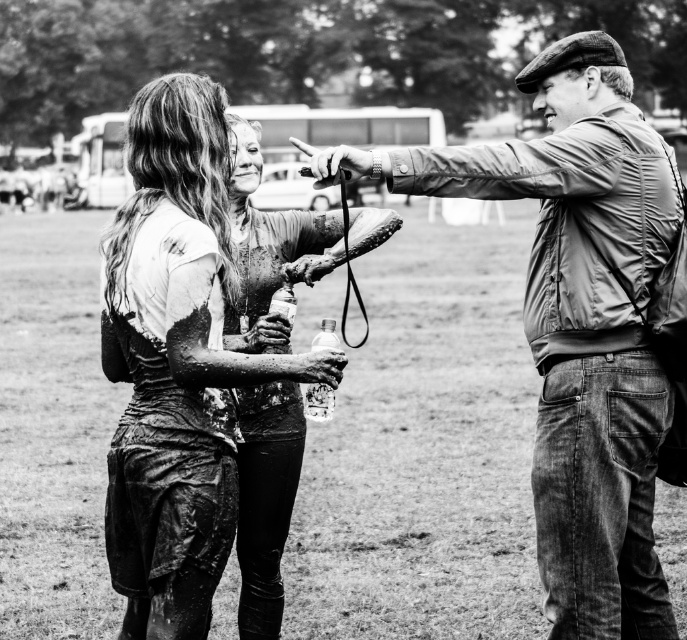
Can you confirm if leather jacket at right is positioned above muddy leather jacket at center?

Indeed, leather jacket at right is positioned over muddy leather jacket at center.

Can you confirm if leather jacket at right is positioned to the right of muddy leather jacket at center?

Correct, you'll find leather jacket at right to the right of muddy leather jacket at center.

Describe the element at coordinates (583, 323) in the screenshot. The width and height of the screenshot is (687, 640). I see `leather jacket at right` at that location.

Where is `leather jacket at right`? leather jacket at right is located at coordinates (583, 323).

What do you see at coordinates (179, 371) in the screenshot? I see `muddy leather jacket at center` at bounding box center [179, 371].

Measure the distance between muddy leather jacket at center and camera.

muddy leather jacket at center and camera are 5.65 meters apart from each other.

Image resolution: width=687 pixels, height=640 pixels. Find the location of `muddy leather jacket at center`. muddy leather jacket at center is located at coordinates (179, 371).

Who is positioned more to the left, leather jacket at right or dirty leather jacket at center?

Positioned to the left is dirty leather jacket at center.

Consider the image. Who is lower down, leather jacket at right or dirty leather jacket at center?

leather jacket at right is lower down.

Identify the location of leather jacket at right. (583, 323).

Where is `leather jacket at right`? leather jacket at right is located at coordinates (583, 323).